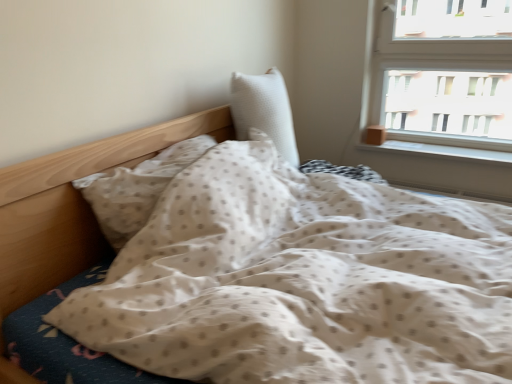
Question: Is white smooth window sill at right not within white textured pillow at center, the first pillow viewed from the right?

Choices:
 (A) yes
 (B) no

Answer: (A)

Question: Does white smooth window sill at right appear on the left side of white textured pillow at center, the second pillow positioned from the left?

Choices:
 (A) no
 (B) yes

Answer: (A)

Question: Is white smooth window sill at right oriented towards white textured pillow at center, the second pillow positioned from the left?

Choices:
 (A) yes
 (B) no

Answer: (B)

Question: Is white smooth window sill at right to the right of white textured pillow at center, the first pillow viewed from the right, from the viewer's perspective?

Choices:
 (A) no
 (B) yes

Answer: (B)

Question: Is white smooth window sill at right thinner than white textured pillow at center, the second pillow positioned from the left?

Choices:
 (A) no
 (B) yes

Answer: (B)

Question: In terms of size, does white textured pillow at center, the second pillow positioned from the left, appear bigger or smaller than white dotted fabric pillow at center, the second pillow viewed from the right?

Choices:
 (A) small
 (B) big

Answer: (B)

Question: From their relative heights in the image, would you say white textured pillow at center, the first pillow viewed from the right, is taller or shorter than white dotted fabric pillow at center, the second pillow viewed from the right?

Choices:
 (A) tall
 (B) short

Answer: (A)

Question: Relative to white dotted fabric pillow at center, the second pillow viewed from the right, is white textured pillow at center, the first pillow viewed from the right, in front or behind?

Choices:
 (A) front
 (B) behind

Answer: (B)

Question: Is white textured pillow at center, the second pillow positioned from the left, situated inside white dotted fabric pillow at center, positioned as the first pillow in left-to-right order, or outside?

Choices:
 (A) inside
 (B) outside

Answer: (B)

Question: Is white smooth window sill at right in front of or behind white dotted fabric pillow at center, the second pillow viewed from the right, in the image?

Choices:
 (A) front
 (B) behind

Answer: (B)

Question: Looking at their shapes, would you say white smooth window sill at right is wider or thinner than white dotted fabric pillow at center, the second pillow viewed from the right?

Choices:
 (A) wide
 (B) thin

Answer: (B)

Question: From the image's perspective, is white smooth window sill at right located above or below white dotted fabric pillow at center, positioned as the first pillow in left-to-right order?

Choices:
 (A) below
 (B) above

Answer: (B)

Question: Would you say white smooth window sill at right is inside or outside white dotted fabric pillow at center, the second pillow viewed from the right?

Choices:
 (A) outside
 (B) inside

Answer: (A)

Question: Does point (462, 145) appear closer or farther from the camera than point (283, 110)?

Choices:
 (A) farther
 (B) closer

Answer: (A)

Question: From a real-world perspective, is white smooth window sill at right above or below white textured pillow at center, the first pillow viewed from the right?

Choices:
 (A) above
 (B) below

Answer: (B)